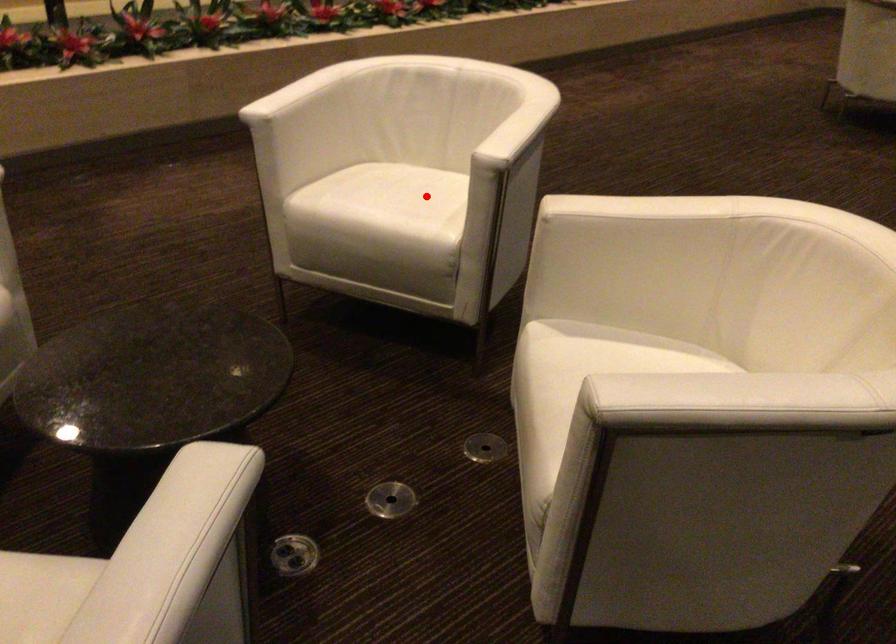
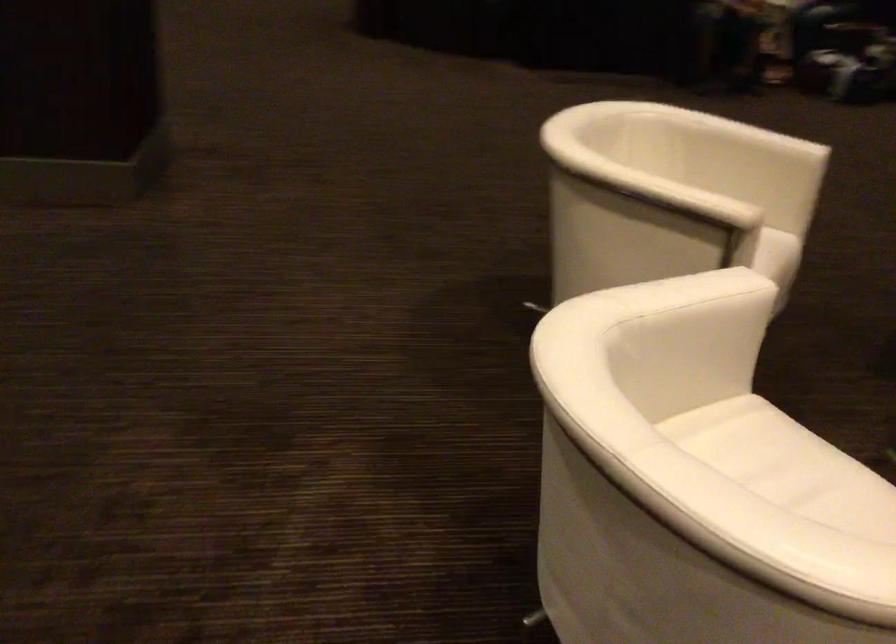
Find the pixel in the second image that matches the highlighted location in the first image.

(767, 453)